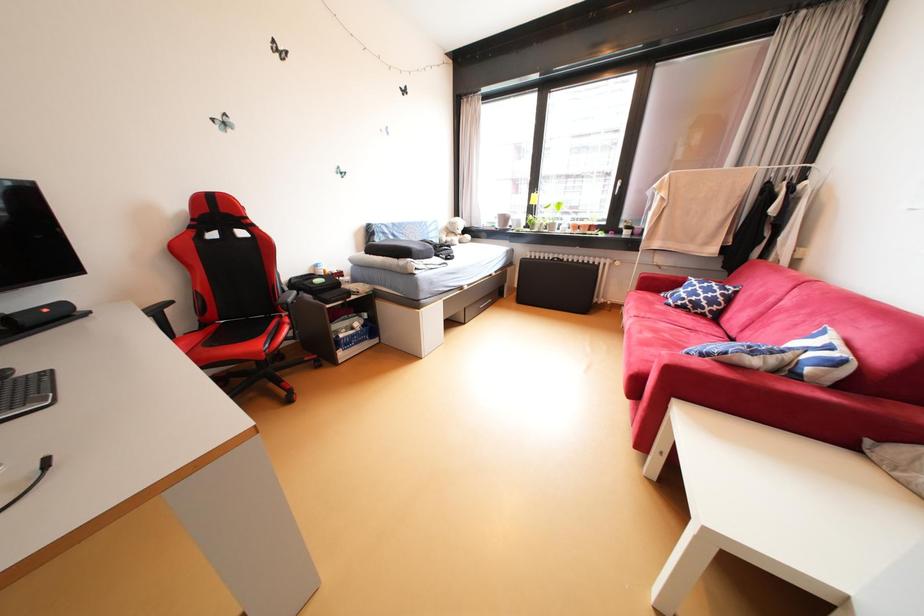
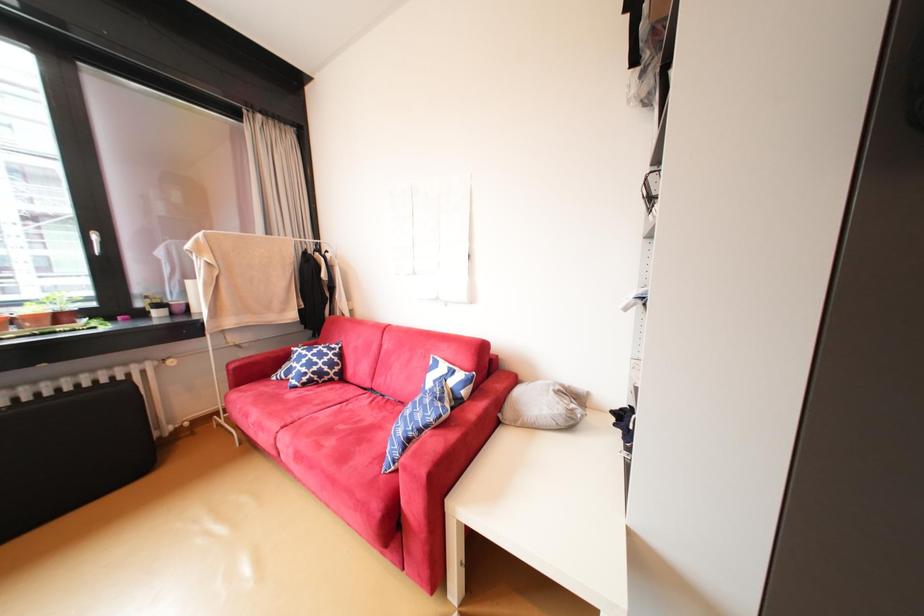
Question: The first image is from the beginning of the video and the second image is from the end. How did the camera likely rotate when shooting the video?

Choices:
 (A) Left
 (B) Right
 (C) Up
 (D) Down

Answer: (B)